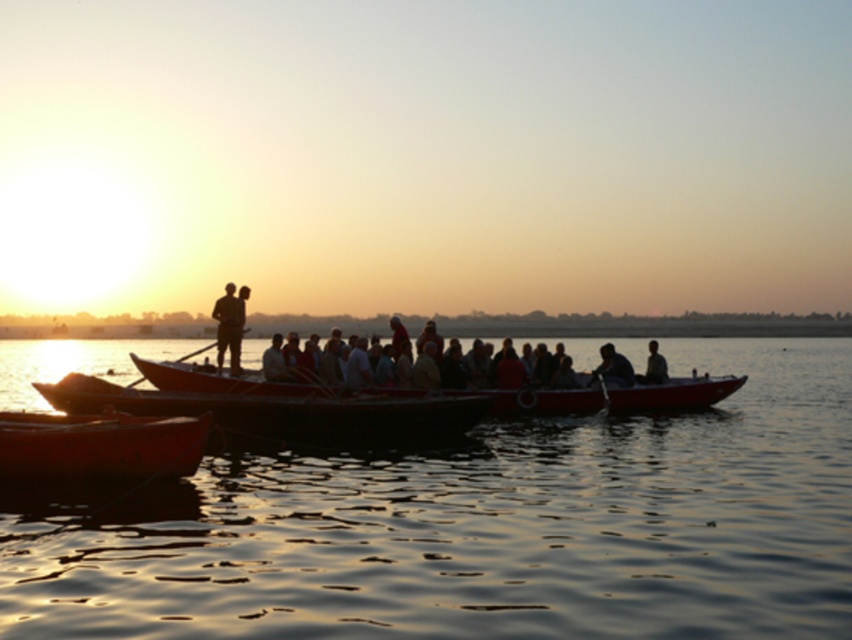
Question: Does smooth wood canoe at lower left come in front of light brown wooden boat at center?

Choices:
 (A) yes
 (B) no

Answer: (A)

Question: Among these points, which one is farthest from the camera?

Choices:
 (A) (603, 353)
 (B) (281, 324)
 (C) (262, 406)

Answer: (B)

Question: Which point is closer to the camera taking this photo?

Choices:
 (A) (619, 365)
 (B) (29, 451)
 (C) (378, 419)

Answer: (B)

Question: Which point appears farthest from the camera in this image?

Choices:
 (A) (619, 353)
 (B) (171, 436)
 (C) (528, 426)
 (D) (213, 316)

Answer: (A)

Question: Can you confirm if glistening water at center is thinner than wooden canoe at center?

Choices:
 (A) yes
 (B) no

Answer: (B)

Question: Is glistening water at center wider than silvery metallic boat at center?

Choices:
 (A) yes
 (B) no

Answer: (A)